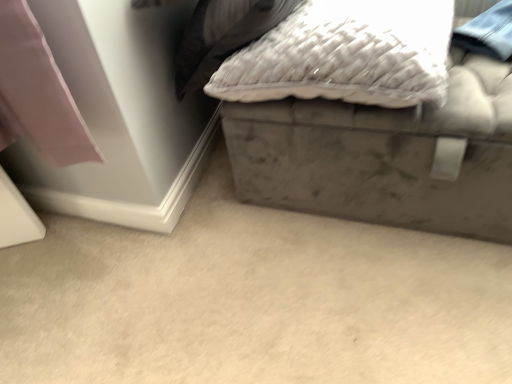
Question: Is gray matte storage box at lower right positioned beyond the bounds of white textured pillow at upper center?

Choices:
 (A) yes
 (B) no

Answer: (A)

Question: Is gray matte storage box at lower right oriented towards white textured pillow at upper center?

Choices:
 (A) yes
 (B) no

Answer: (B)

Question: Is white textured pillow at upper center a part of gray matte storage box at lower right?

Choices:
 (A) no
 (B) yes

Answer: (A)

Question: From a real-world perspective, is gray matte storage box at lower right on top of white textured pillow at upper center?

Choices:
 (A) yes
 (B) no

Answer: (B)

Question: Is gray matte storage box at lower right thinner than white textured pillow at upper center?

Choices:
 (A) no
 (B) yes

Answer: (A)

Question: Are gray matte storage box at lower right and white textured pillow at upper center located far from each other?

Choices:
 (A) yes
 (B) no

Answer: (B)

Question: Does velvet gray ottoman at upper right have a larger size compared to white textured pillow at upper center?

Choices:
 (A) yes
 (B) no

Answer: (A)

Question: Does velvet gray ottoman at upper right have a greater height compared to white textured pillow at upper center?

Choices:
 (A) yes
 (B) no

Answer: (A)

Question: Is velvet gray ottoman at upper right not within white textured pillow at upper center?

Choices:
 (A) yes
 (B) no

Answer: (A)

Question: Considering the relative sizes of velvet gray ottoman at upper right and white textured pillow at upper center in the image provided, is velvet gray ottoman at upper right shorter than white textured pillow at upper center?

Choices:
 (A) yes
 (B) no

Answer: (B)

Question: Is white textured pillow at upper center surrounded by velvet gray ottoman at upper right?

Choices:
 (A) no
 (B) yes

Answer: (A)

Question: From a real-world perspective, is velvet gray ottoman at upper right over white textured pillow at upper center?

Choices:
 (A) no
 (B) yes

Answer: (A)

Question: Could you tell me if white textured pillow at upper center is facing gray matte storage box at lower right?

Choices:
 (A) no
 (B) yes

Answer: (A)